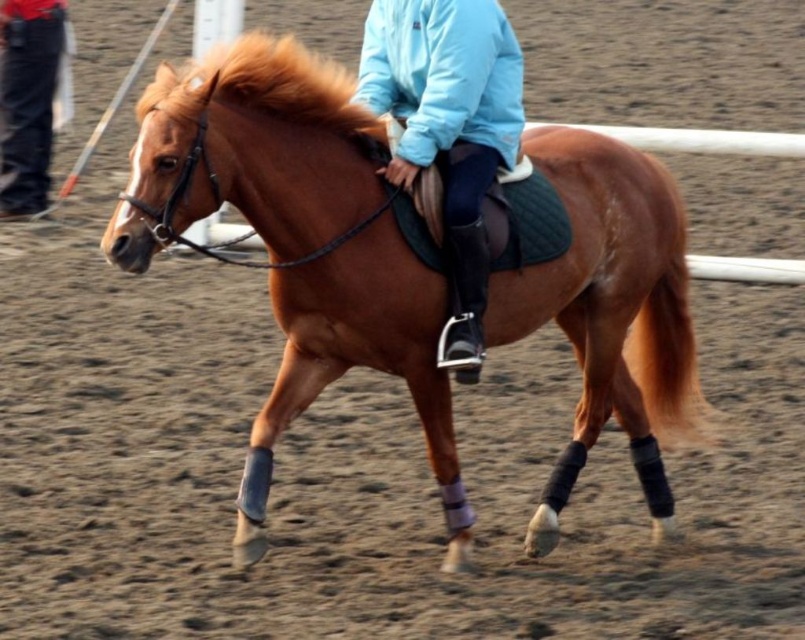
Is point (246, 122) farther from camera compared to point (170, 93)?

Yes.

Identify the location of brown glossy horse at center. (609, 312).

Does point (382, 266) come behind point (333, 67)?

No, it is not.

The height and width of the screenshot is (640, 805). Identify the location of brown glossy horse at center. (609, 312).

Locate an element on the screen. The image size is (805, 640). brown glossy horse at center is located at coordinates (609, 312).

Does point (248, 483) come farther from viewer compared to point (420, 44)?

No, it is in front of (420, 44).

Does point (618, 355) come in front of point (510, 83)?

No, it is not.

Locate an element on the screen. brown glossy horse at center is located at coordinates (609, 312).

Does brown glossy horse at center have a greater width compared to black jeans at left?

Yes.

Between brown glossy horse at center and black jeans at left, which one appears on the right side from the viewer's perspective?

brown glossy horse at center is more to the right.

The width and height of the screenshot is (805, 640). I want to click on brown glossy horse at center, so click(x=609, y=312).